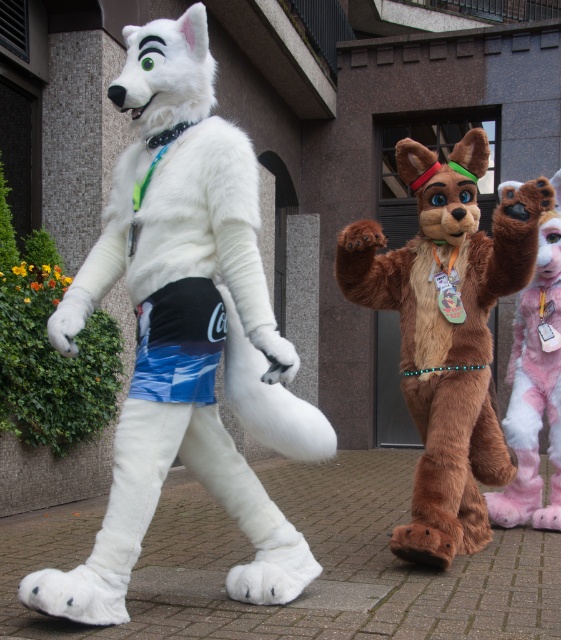
Which is behind, point (452, 195) or point (517, 406)?

The point (517, 406) is behind.

Consider the image. How far apart are brown furry dog at center and fuzzy brown fur at right?

brown furry dog at center is 28.55 inches away from fuzzy brown fur at right.

Is point (426, 413) less distant than point (514, 387)?

Yes, it is.

Locate an element on the screen. The height and width of the screenshot is (640, 561). brown furry dog at center is located at coordinates (448, 332).

Does white fur mascot at left have a larger size compared to fuzzy brown fur at right?

Correct, white fur mascot at left is larger in size than fuzzy brown fur at right.

Looking at this image, does white fur mascot at left have a lesser width compared to fuzzy brown fur at right?

In fact, white fur mascot at left might be wider than fuzzy brown fur at right.

Between point (213, 388) and point (555, 385), which one is positioned behind?

The point (555, 385) is behind.

The height and width of the screenshot is (640, 561). I want to click on white fur mascot at left, so click(x=186, y=332).

This screenshot has height=640, width=561. Find the location of `white fur mascot at left`. white fur mascot at left is located at coordinates (186, 332).

Does point (105, 529) lie in front of point (434, 248)?

Yes, it is in front of point (434, 248).

Is point (163, 200) behind point (364, 272)?

No.

What are the coordinates of `white fur mascot at left` in the screenshot? It's located at (186, 332).